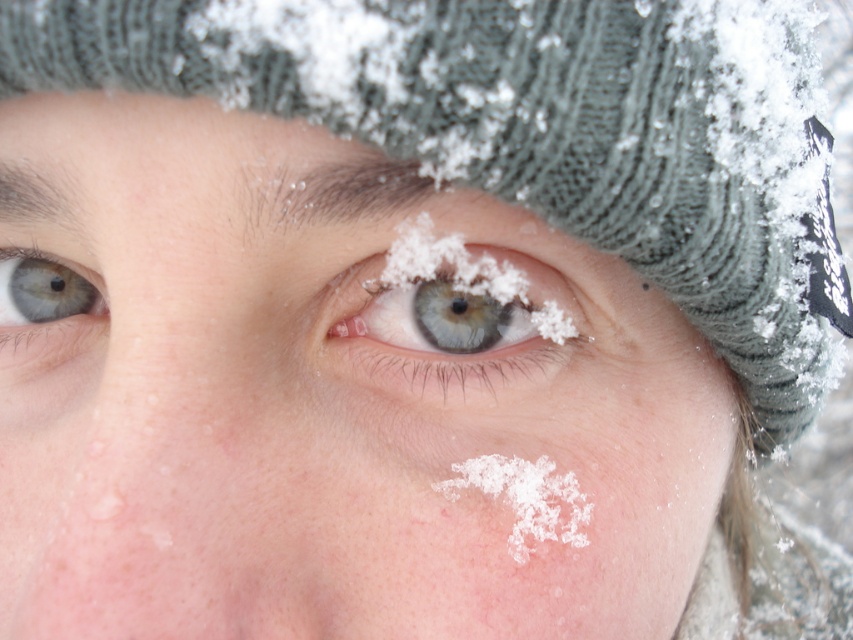
Is white crystalline snowflake at lower center above blue matte eye at upper left?

No, white crystalline snowflake at lower center is not above blue matte eye at upper left.

Does white crystalline snowflake at lower center appear on the right side of blue matte eye at upper left?

Correct, you'll find white crystalline snowflake at lower center to the right of blue matte eye at upper left.

Which is in front, point (523, 548) or point (3, 253)?

Point (523, 548) is in front.

Locate an element on the screen. The height and width of the screenshot is (640, 853). white crystalline snowflake at lower center is located at coordinates (525, 499).

Is blue matte eye at center to the right of white crystalline snowflake at lower center from the viewer's perspective?

No, blue matte eye at center is not to the right of white crystalline snowflake at lower center.

Is point (466, 300) closer to viewer compared to point (462, 490)?

No.

Where is `blue matte eye at center`? The width and height of the screenshot is (853, 640). blue matte eye at center is located at coordinates (463, 312).

Between blue matte eye at center and blue matte eye at upper left, which one is positioned lower?

blue matte eye at center

Does blue matte eye at center have a lesser width compared to blue matte eye at upper left?

No, blue matte eye at center is not thinner than blue matte eye at upper left.

Where is `blue matte eye at center`? blue matte eye at center is located at coordinates (463, 312).